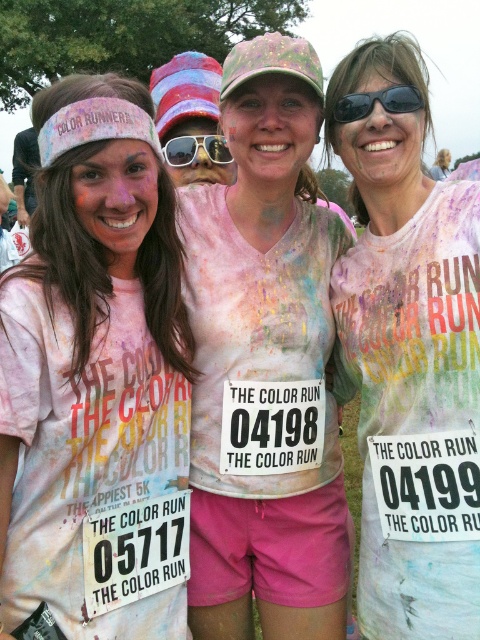
Is black plastic sunglasses at upper center in front of sunglasses at center?

Yes.

Is black plastic sunglasses at upper center smaller than sunglasses at center?

Indeed, black plastic sunglasses at upper center has a smaller size compared to sunglasses at center.

Between point (406, 84) and point (213, 148), which one is positioned in front?

Point (406, 84) is more forward.

Locate an element on the screen. The image size is (480, 640). black plastic sunglasses at upper center is located at coordinates (376, 100).

Between matte white t-shirt at center and black plastic sunglasses at upper center, which one appears on the left side from the viewer's perspective?

black plastic sunglasses at upper center

The image size is (480, 640). Describe the element at coordinates (409, 358) in the screenshot. I see `matte white t-shirt at center` at that location.

Identify the location of matte white t-shirt at center. This screenshot has height=640, width=480. (409, 358).

Who is shorter, matte white headband at upper left or sunglasses at center?

sunglasses at center

Does point (123, 150) come behind point (192, 134)?

No, it is not.

The height and width of the screenshot is (640, 480). I want to click on matte white headband at upper left, so click(96, 378).